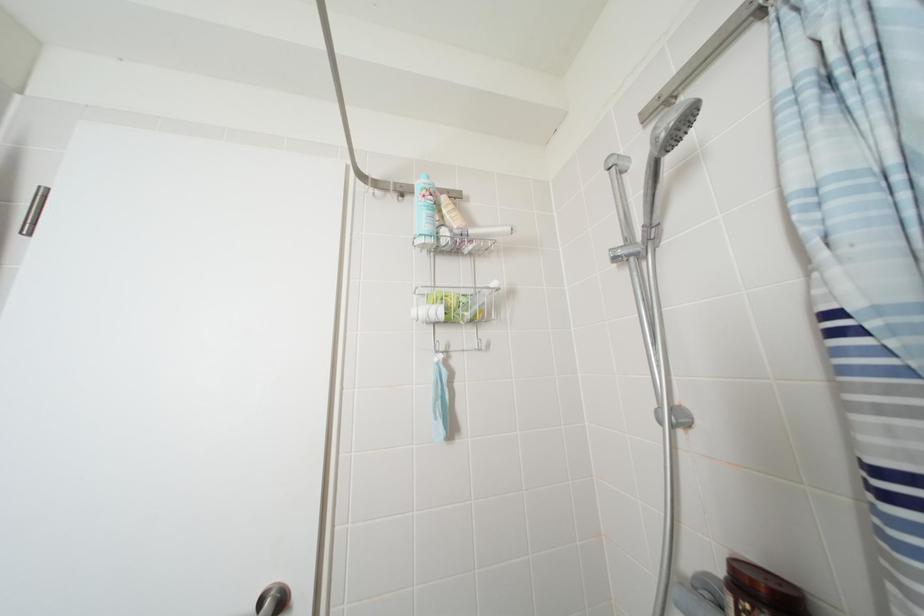
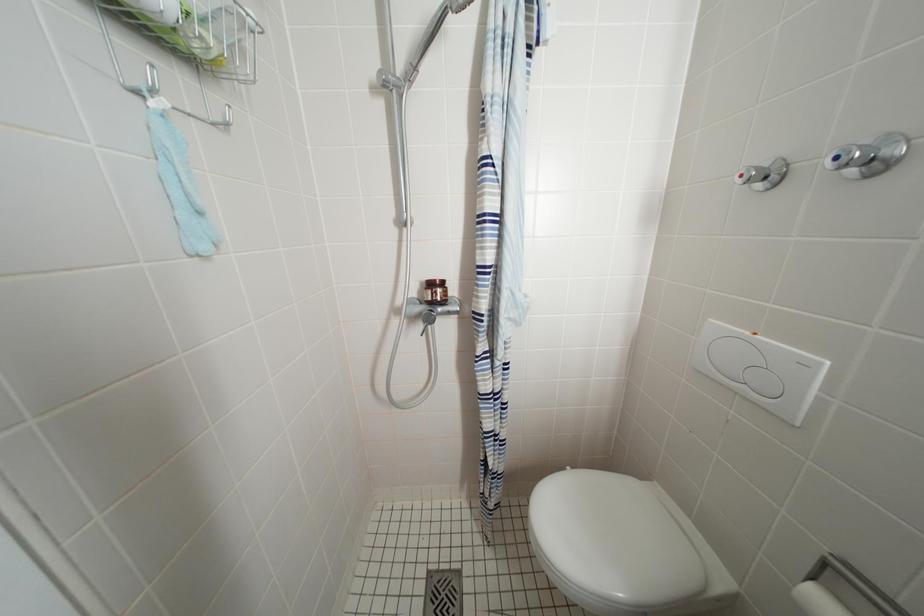
Based on the continuous images, in which direction is the camera rotating?

The camera rotated toward right-down.